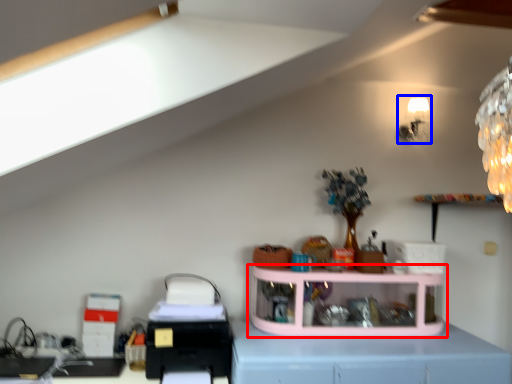
Question: Among these objects, which one is nearest to the camera, shelf (highlighted by a red box) or lamp (highlighted by a blue box)?

Choices:
 (A) shelf
 (B) lamp

Answer: (A)